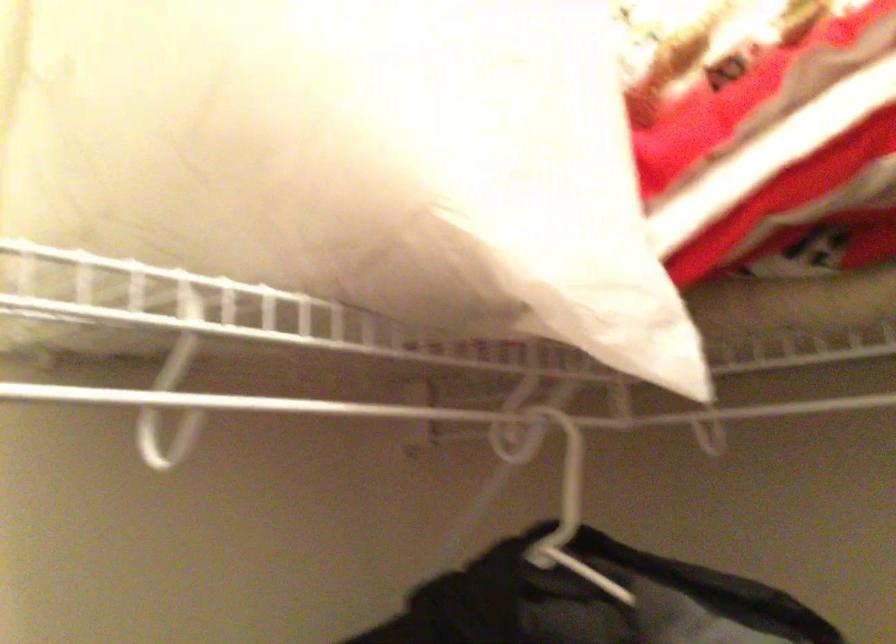
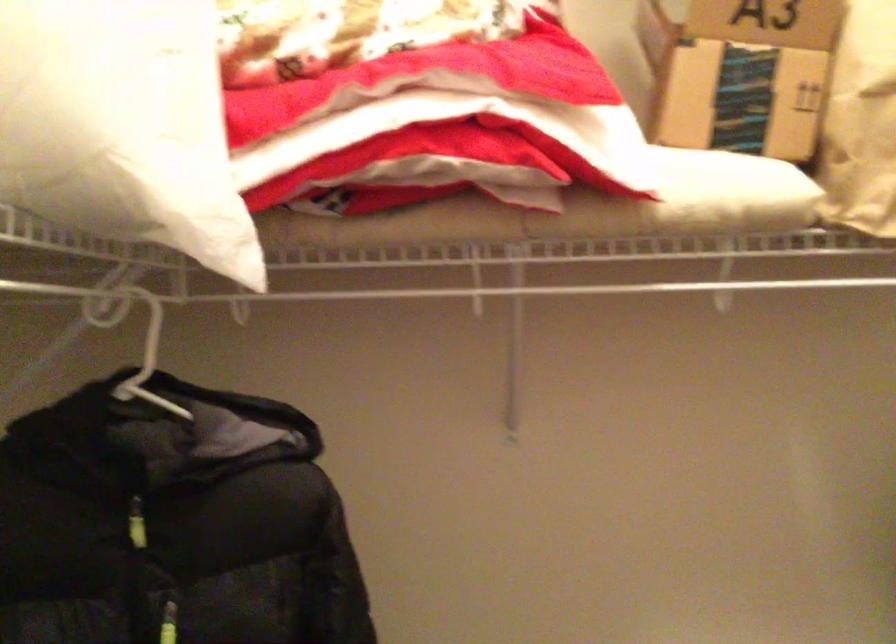
Question: The camera is either moving clockwise (left) or counter-clockwise (right) around the object. The first image is from the beginning of the video and the second image is from the end. Is the camera moving left or right when shooting the video?

Choices:
 (A) Left
 (B) Right

Answer: (A)